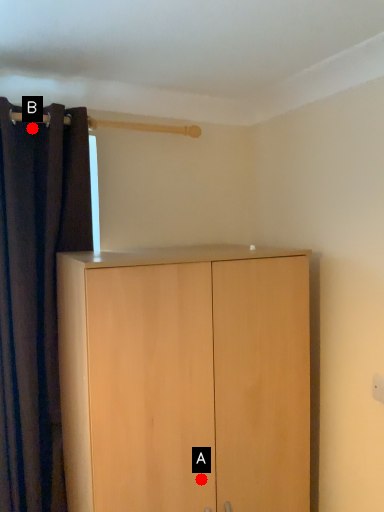
Question: Two points are circled on the image, labeled by A and B beside each circle. Among these points, which one is nearest to the camera?

Choices:
 (A) A is closer
 (B) B is closer

Answer: (A)